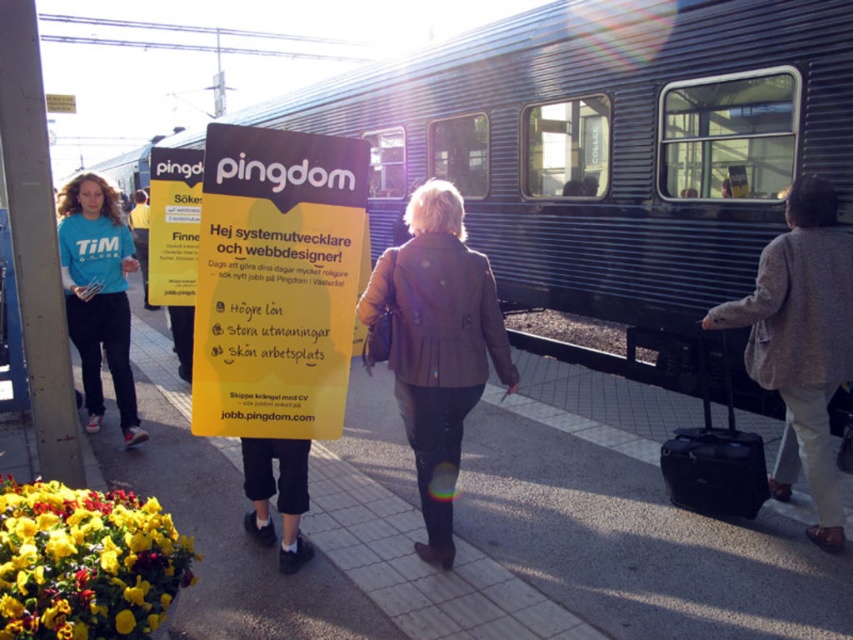
You are a passenger standing on the platform and want to board the metallic blue train at center. Your backpack is as wide as the brown leather jacket at center. Will your backpack fit through the train doors?

The metallic blue train at center has a width larger than the brown leather jacket at center, so your backpack, which is as wide as the brown leather jacket at center, will fit through the train doors.

You are a pedestrian on the train station platform. You see a brown leather jacket at center and a light beige wool coat at center. Which one is closer to you?

The brown leather jacket at center is closer to you because it is in front of the light beige wool coat at center.